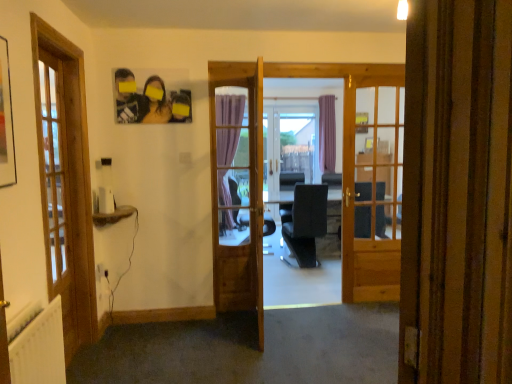
Question: Would you say wooden door at center is outside white textured radiator at lower left?

Choices:
 (A) no
 (B) yes

Answer: (B)

Question: Does wooden door at center appear on the left side of white textured radiator at lower left?

Choices:
 (A) no
 (B) yes

Answer: (A)

Question: Is wooden door at center to the right of white textured radiator at lower left from the viewer's perspective?

Choices:
 (A) no
 (B) yes

Answer: (B)

Question: Is wooden door at center turned away from white textured radiator at lower left?

Choices:
 (A) yes
 (B) no

Answer: (B)

Question: Is wooden door at center closer to the viewer compared to white textured radiator at lower left?

Choices:
 (A) yes
 (B) no

Answer: (B)

Question: Is white plastic screen door at center taller or shorter than white textured radiator at lower left?

Choices:
 (A) short
 (B) tall

Answer: (B)

Question: Relative to white textured radiator at lower left, is white plastic screen door at center in front or behind?

Choices:
 (A) front
 (B) behind

Answer: (B)

Question: In the image, is white plastic screen door at center on the left side or the right side of white textured radiator at lower left?

Choices:
 (A) right
 (B) left

Answer: (A)

Question: Considering the positions of white plastic screen door at center and white textured radiator at lower left in the image, is white plastic screen door at center bigger or smaller than white textured radiator at lower left?

Choices:
 (A) big
 (B) small

Answer: (A)

Question: Considering the positions of white textured radiator at lower left and wooden door at center in the image, is white textured radiator at lower left wider or thinner than wooden door at center?

Choices:
 (A) wide
 (B) thin

Answer: (A)

Question: Would you say white textured radiator at lower left is to the left or to the right of wooden door at center in the picture?

Choices:
 (A) left
 (B) right

Answer: (A)

Question: Is point (25, 377) positioned closer to the camera than point (262, 100)?

Choices:
 (A) farther
 (B) closer

Answer: (B)

Question: From the image's perspective, is white textured radiator at lower left positioned above or below wooden door at center?

Choices:
 (A) below
 (B) above

Answer: (A)

Question: In the image, is white plastic screen door at center positioned in front of or behind wooden door at center?

Choices:
 (A) behind
 (B) front

Answer: (A)

Question: Considering the positions of point (287, 122) and point (260, 263), is point (287, 122) closer or farther from the camera than point (260, 263)?

Choices:
 (A) closer
 (B) farther

Answer: (B)